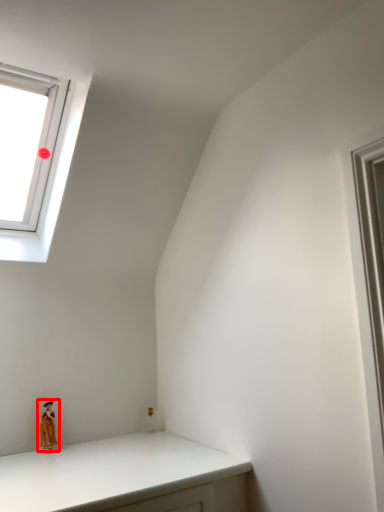
Question: Considering the relative positions of doll (annotated by the red box) and window in the image provided, where is doll (annotated by the red box) located with respect to the staircase?

Choices:
 (A) left
 (B) right

Answer: (B)